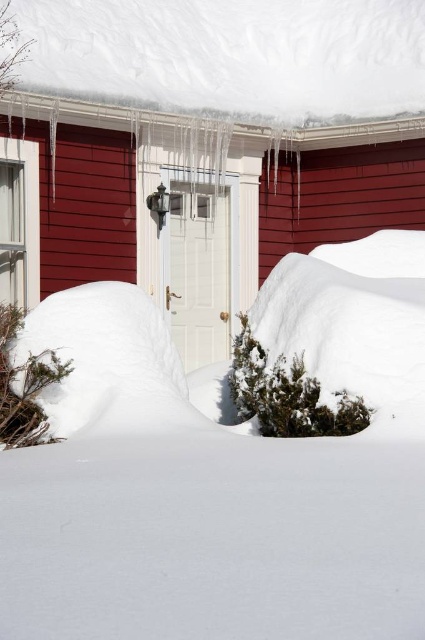
Question: Observing the image, what is the correct spatial positioning of white fluffy snow at center in reference to white snow-covered roof at upper center?

Choices:
 (A) right
 (B) left

Answer: (A)

Question: Does white fluffy snow at center come in front of white snow-covered roof at upper center?

Choices:
 (A) yes
 (B) no

Answer: (A)

Question: Does white fluffy snow at center have a larger size compared to white snow-covered roof at upper center?

Choices:
 (A) yes
 (B) no

Answer: (B)

Question: Which point appears closest to the camera in this image?

Choices:
 (A) (64, 492)
 (B) (27, 12)

Answer: (A)